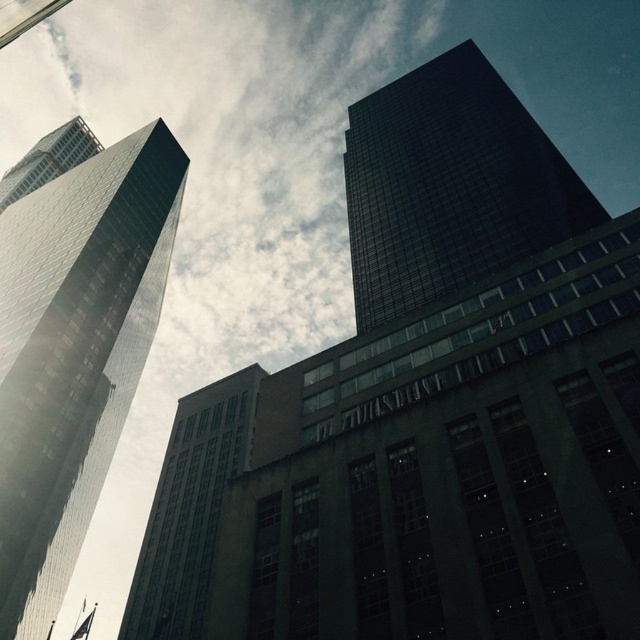
Question: Which object is the closest to the reflective glass skyscraper at left?

Choices:
 (A) dark glass skyscraper at upper right
 (B) glassy reflective skyscraper at upper left

Answer: (A)

Question: Can you confirm if reflective glass skyscraper at left is positioned above glassy reflective skyscraper at upper left?

Choices:
 (A) yes
 (B) no

Answer: (B)

Question: Which is nearer to the glassy reflective skyscraper at upper left?

Choices:
 (A) reflective glass skyscraper at left
 (B) dark glass skyscraper at upper right

Answer: (A)

Question: In this image, where is reflective glass skyscraper at left located relative to glassy reflective skyscraper at upper left?

Choices:
 (A) below
 (B) above

Answer: (A)

Question: Which object appears closest to the camera in this image?

Choices:
 (A) dark glass skyscraper at upper right
 (B) reflective glass skyscraper at left

Answer: (A)

Question: From the image, what is the correct spatial relationship of dark glass skyscraper at upper right in relation to glassy reflective skyscraper at upper left?

Choices:
 (A) below
 (B) above

Answer: (A)